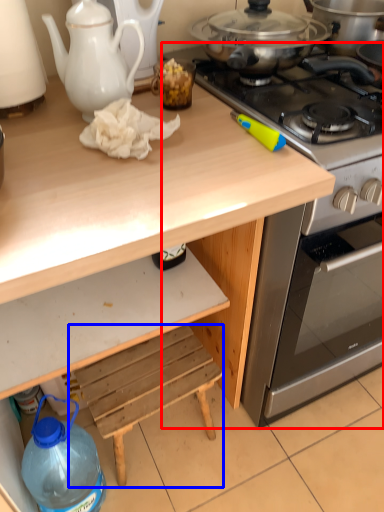
Question: Which object is further to the camera taking this photo, oven (highlighted by a red box) or step stool (highlighted by a blue box)?

Choices:
 (A) oven
 (B) step stool

Answer: (B)